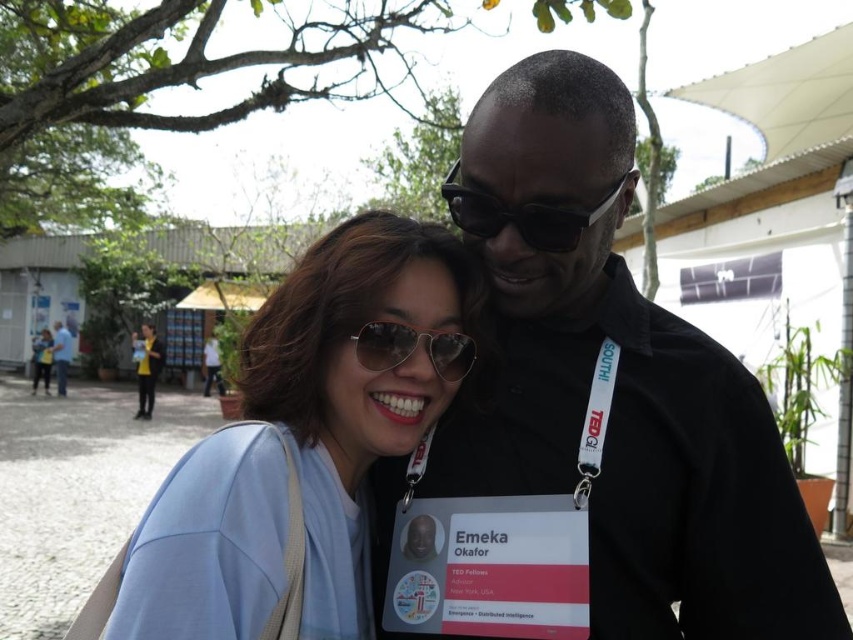
Question: Based on their relative distances, which object is farther from the black plastic sunglasses at upper center?

Choices:
 (A) metallic reflective goggles at center
 (B) black matte shirt at upper right
 (C) blue shirt at left
 (D) light blue fabric at center

Answer: (C)

Question: Among these objects, which one is farthest from the camera?

Choices:
 (A) black plastic sunglasses at upper center
 (B) metallic reflective goggles at center

Answer: (B)

Question: Observing the image, what is the correct spatial positioning of black matte shirt at upper right in reference to light blue fabric at center?

Choices:
 (A) right
 (B) left

Answer: (A)

Question: Is light blue fabric at center to the left of blue shirt at left from the viewer's perspective?

Choices:
 (A) yes
 (B) no

Answer: (B)

Question: Is black plastic sunglasses at upper center above metallic reflective goggles at center?

Choices:
 (A) yes
 (B) no

Answer: (A)

Question: Which of the following is the closest to the observer?

Choices:
 (A) (166, 609)
 (B) (527, 211)

Answer: (A)